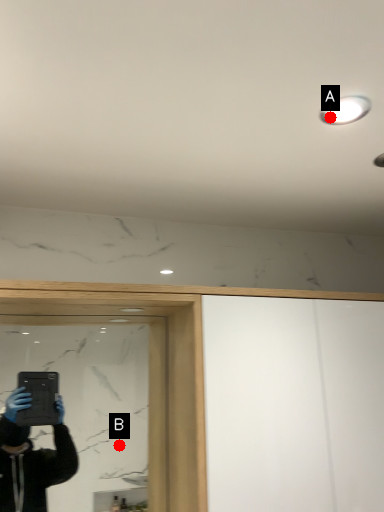
Question: Two points are circled on the image, labeled by A and B beside each circle. Which point is farther from the camera taking this photo?

Choices:
 (A) A is further
 (B) B is further

Answer: (B)